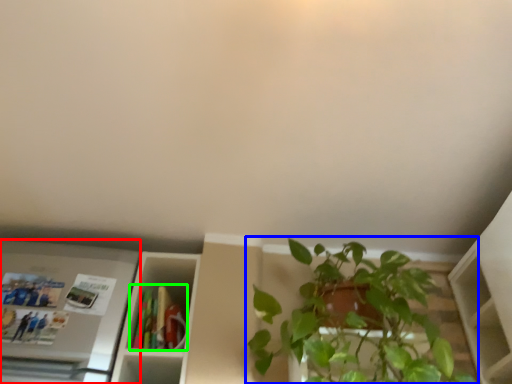
Question: Which object is the closest to the appliance (highlighted by a red box)? Choose among these: houseplant (highlighted by a blue box) or book (highlighted by a green box).

Choices:
 (A) houseplant
 (B) book

Answer: (B)